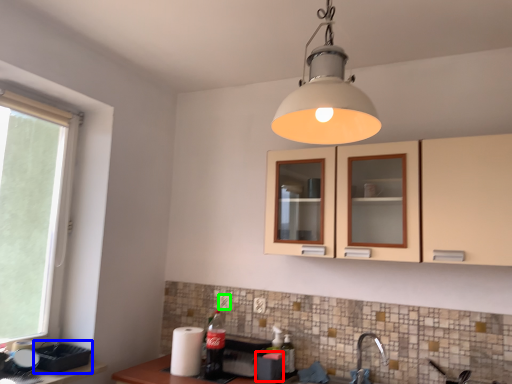
Question: Which is farther away from appliance (highlighted by a red box)? appliance (highlighted by a blue box) or electric outlet (highlighted by a green box)?

Choices:
 (A) appliance
 (B) electric outlet

Answer: (A)